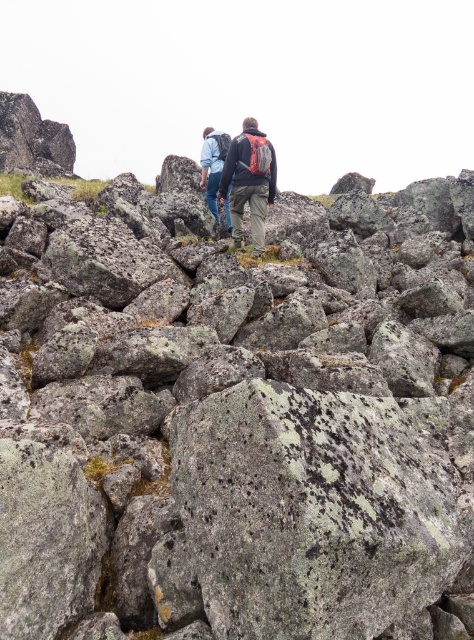
Question: Which of these objects is positioned farthest from the gray rough rock at center?

Choices:
 (A) blue denim jacket at center
 (B) matte black jacket at center

Answer: (A)

Question: Does matte black jacket at center have a larger size compared to blue denim jacket at center?

Choices:
 (A) no
 (B) yes

Answer: (A)

Question: Is matte black jacket at center smaller than blue denim jacket at center?

Choices:
 (A) yes
 (B) no

Answer: (A)

Question: Among these points, which one is nearest to the camera?

Choices:
 (A) (213, 189)
 (B) (346, 572)

Answer: (B)

Question: Is gray rough rock at center to the left of matte black jacket at center from the viewer's perspective?

Choices:
 (A) no
 (B) yes

Answer: (B)

Question: Which point appears closest to the camera in this image?

Choices:
 (A) (203, 500)
 (B) (216, 182)

Answer: (A)